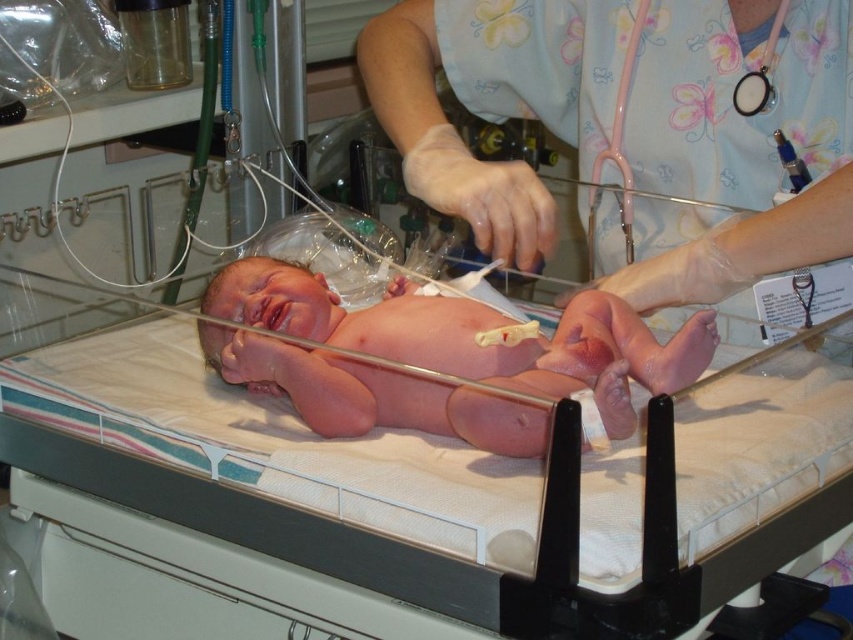
Question: Which of the following is the farthest from the observer?

Choices:
 (A) pink smooth skin at center
 (B) pink floral scrubs at center

Answer: (B)

Question: Can you confirm if pink floral scrubs at center is positioned below pink rubber stethoscope at upper right?

Choices:
 (A) no
 (B) yes

Answer: (A)

Question: Does pink smooth skin at center have a greater width compared to pink rubber stethoscope at upper right?

Choices:
 (A) no
 (B) yes

Answer: (B)

Question: Which point is closer to the camera?

Choices:
 (A) pink floral scrubs at center
 (B) pink rubber stethoscope at upper right

Answer: (A)

Question: Can you confirm if pink floral scrubs at center is positioned to the right of pink smooth skin at center?

Choices:
 (A) no
 (B) yes

Answer: (B)

Question: Which point is farther to the camera?

Choices:
 (A) (610, 156)
 (B) (366, 80)
 (C) (276, 364)

Answer: (B)